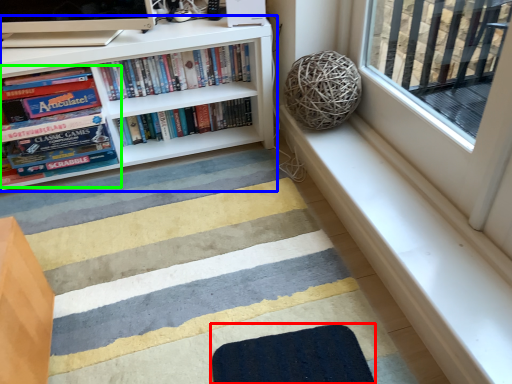
Question: Based on their relative distances, which object is nearer to doormat (highlighted by a red box)? Choose from bookcase (highlighted by a blue box) and book (highlighted by a green box).

Choices:
 (A) bookcase
 (B) book

Answer: (A)